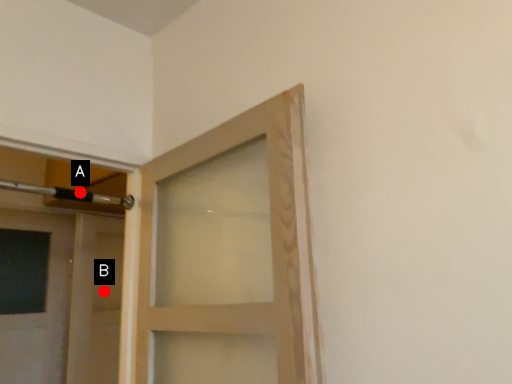
Question: Two points are circled on the image, labeled by A and B beside each circle. Which point is closer to the camera?

Choices:
 (A) A is closer
 (B) B is closer

Answer: (A)